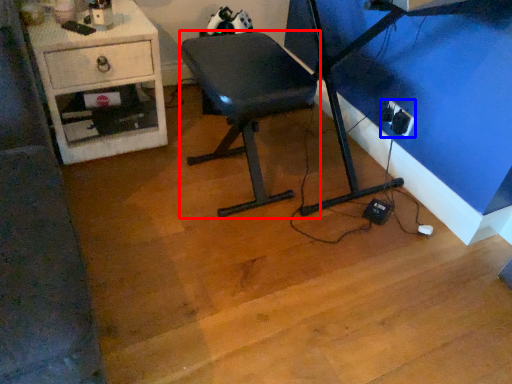
Question: Which point is closer to the camera, furniture (highlighted by a red box) or electric outlet (highlighted by a blue box)?

Choices:
 (A) furniture
 (B) electric outlet

Answer: (A)